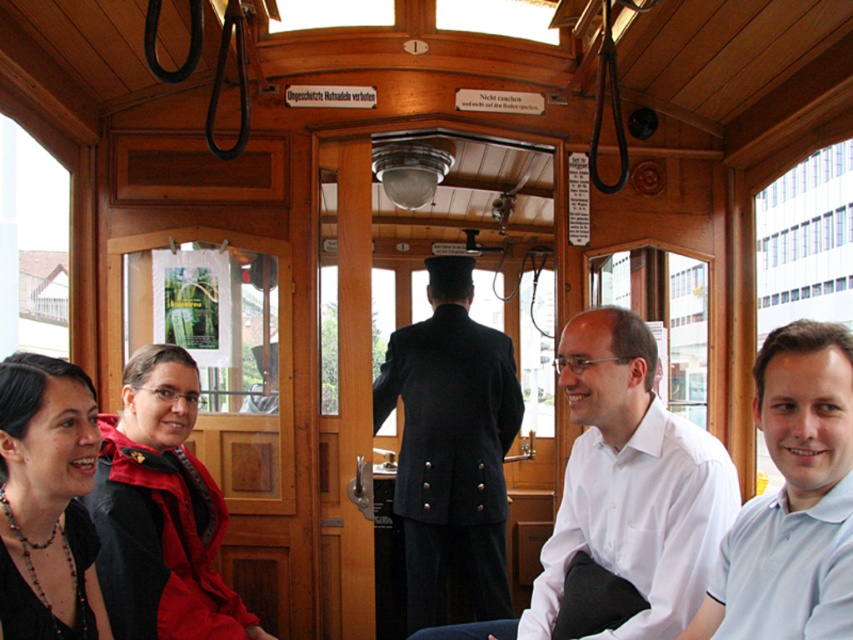
Based on the photo, you are a passenger in the vintage tram and you see the point marked as point [792,499]. What object is located at that point?

The point [792,499] corresponds to the white cotton polo shirt at center.

You are a passenger in the vintage tram and want to locate the dark blue uniform at center. According to the coordinate system where the bottom left corner is the origin, can you confirm if the point at [451,448] is the correct location?

Yes, the dark blue uniform at center is represented by point at [451,448], so this is the correct location.